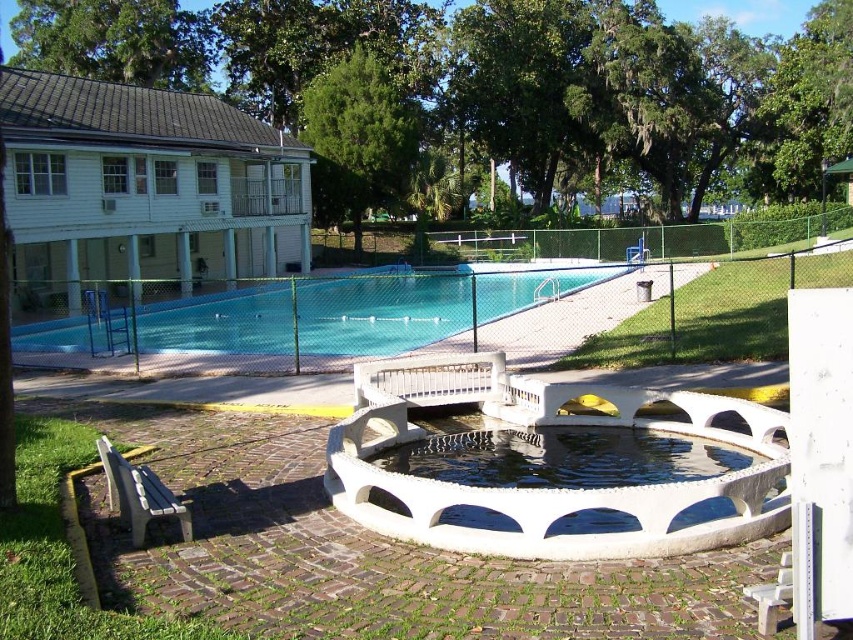
You are planning to place a new bench in the outdoor area. The bench requires a space of 2 meters in length. Given the sizes of the white smooth fountain at center and the blue smooth pool at center, which object would allow enough space for the bench around it?

The blue smooth pool at center is larger than the white smooth fountain at center. Since the bench requires 2 meters of space, the area around the blue smooth pool at center likely provides sufficient space for placement.